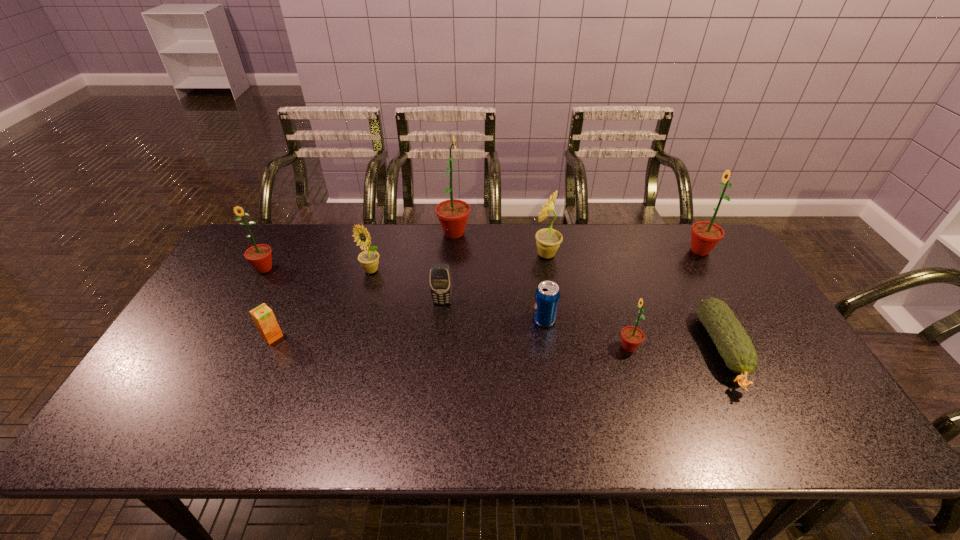
What are the coordinates of `the third object from left to right` in the screenshot? It's located at (369, 259).

You are a GUI agent. You are given a task and a screenshot of the screen. Output one action in this format:
    pyautogui.click(x=<x>, y=<y>)
    Task: Click on the left yellow sunflower
    
    Given the screenshot: What is the action you would take?
    pyautogui.click(x=369, y=259)

I want to click on the fifth nearest object, so click(x=439, y=274).

Locate an element on the screen. Image resolution: width=960 pixels, height=540 pixels. blue pop soda is located at coordinates (547, 295).

Where is `the ninth object from right to left`? the ninth object from right to left is located at coordinates (263, 317).

Find the location of a particular element. the shortest object is located at coordinates (735, 347).

Locate an element on the screen. the second object from right to left is located at coordinates (735, 347).

The width and height of the screenshot is (960, 540). Find the location of `free space located on the face of the fourth sunflower from right to left`. free space located on the face of the fourth sunflower from right to left is located at coordinates (540, 233).

What are the coordinates of `free space located on the face of the second tallest object` in the screenshot? It's located at (640, 251).

At what (x,y) coordinates should I click in order to perform the action: click on vacant area situated 0.400m on the face of the second tallest object. Please return your answer as a coordinate pair (x, y). Image resolution: width=960 pixels, height=540 pixels. Looking at the image, I should click on (565, 251).